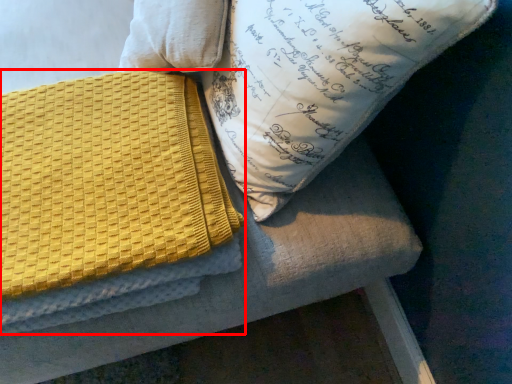
Question: Observing the image, what is the correct spatial positioning of blanket (annotated by the red box) in reference to pillow?

Choices:
 (A) right
 (B) left

Answer: (B)